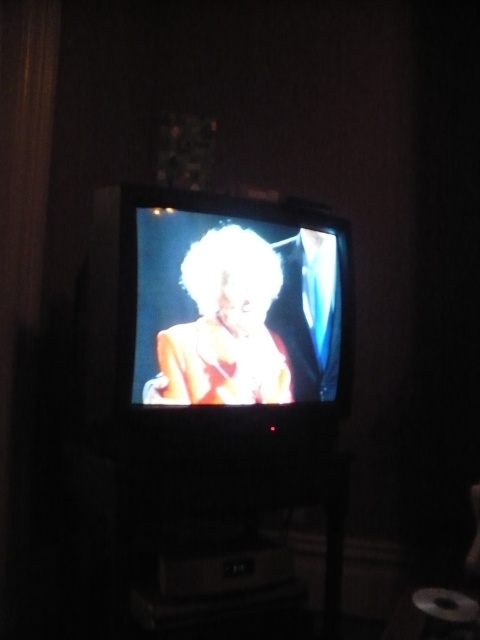
Question: Is shiny black television at center to the right of shiny gold dress at center from the viewer's perspective?

Choices:
 (A) yes
 (B) no

Answer: (B)

Question: Which of the following is the closest to the observer?

Choices:
 (A) (328, 356)
 (B) (156, 396)

Answer: (B)

Question: Is shiny black television at center in front of shiny gold dress at center?

Choices:
 (A) no
 (B) yes

Answer: (B)

Question: Which of the following is the closest to the observer?

Choices:
 (A) (233, 301)
 (B) (141, 332)

Answer: (B)

Question: Can you confirm if shiny black television at center is wider than shiny gold dress at center?

Choices:
 (A) no
 (B) yes

Answer: (B)